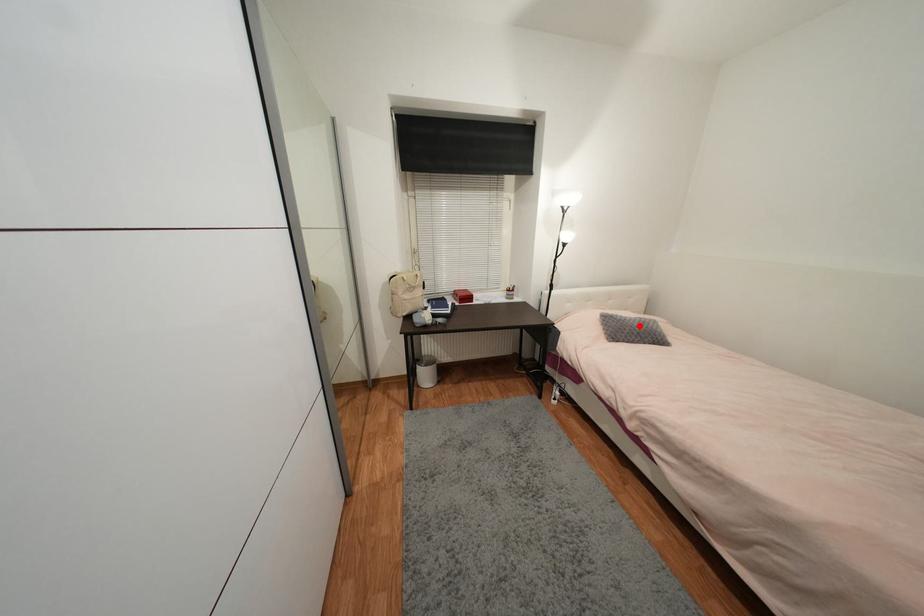
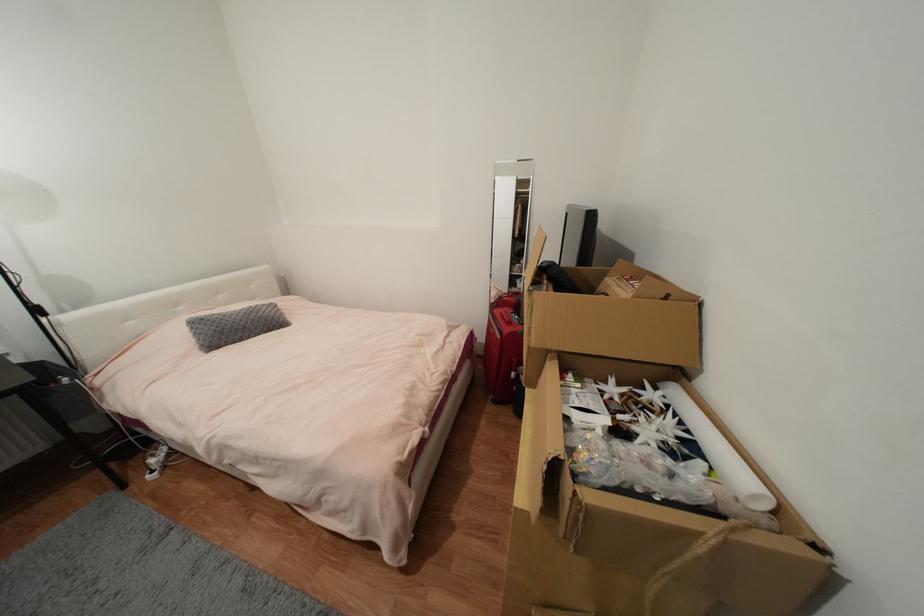
Locate, in the second image, the point that corresponds to the highlighted location in the first image.

(244, 320)